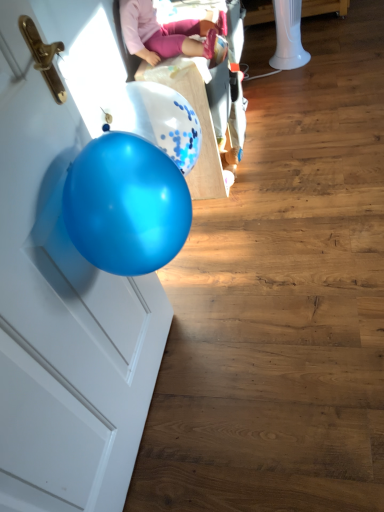
Question: In terms of height, does glossy blue balloon at left look taller or shorter compared to pink fabric doll at upper center?

Choices:
 (A) tall
 (B) short

Answer: (A)

Question: From a real-world perspective, is glossy blue balloon at left physically located above or below pink fabric doll at upper center?

Choices:
 (A) above
 (B) below

Answer: (B)

Question: Which is farther from the white plastic baby carriage at upper center?

Choices:
 (A) pink fabric doll at upper center
 (B) glossy blue balloon at left

Answer: (B)

Question: Which is farther from the glossy blue balloon at left?

Choices:
 (A) white plastic baby carriage at upper center
 (B) pink fabric doll at upper center

Answer: (A)